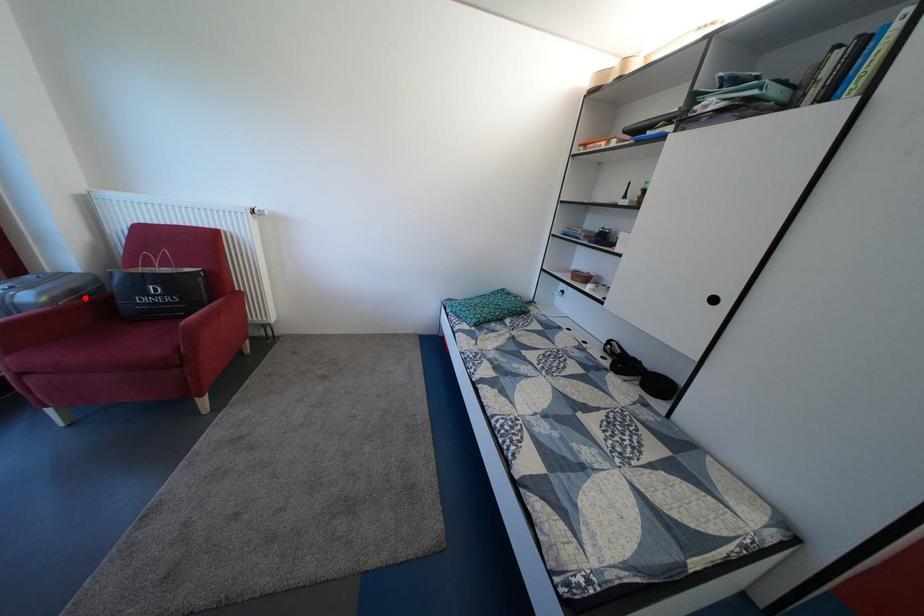
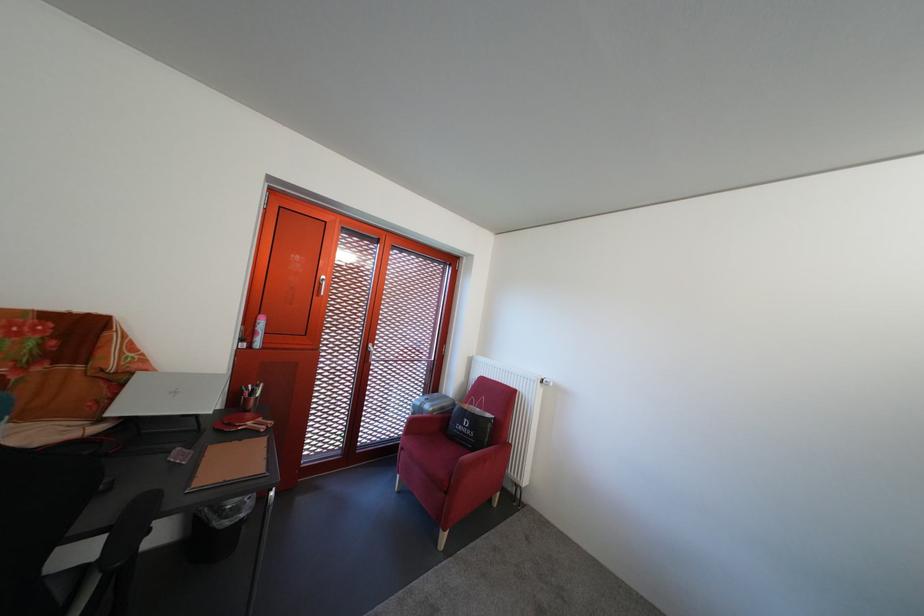
Question: I am providing you with two images of the same scene from different viewpoints. A red point is shown in image1. For the corresponding object point in image2, is it positioned nearer or farther from the camera?

Choices:
 (A) Nearer
 (B) Farther

Answer: (B)